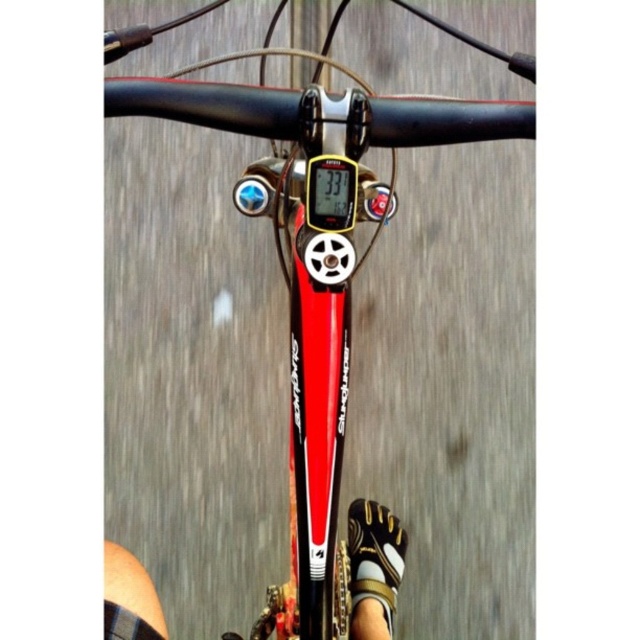
Is shiny metallic bicycle at center taller than white textured shoe at lower center?

Yes, shiny metallic bicycle at center is taller than white textured shoe at lower center.

Does point (168, 97) come closer to viewer compared to point (371, 582)?

Yes, it is.

Identify the location of shiny metallic bicycle at center. This screenshot has height=640, width=640. (316, 264).

Is shiny metallic bicycle at center thinner than white textured sandal at lower center?

In fact, shiny metallic bicycle at center might be wider than white textured sandal at lower center.

Is shiny metallic bicycle at center taller than white textured sandal at lower center?

Indeed, shiny metallic bicycle at center has a greater height compared to white textured sandal at lower center.

Between point (173, 88) and point (355, 572), which one is positioned behind?

Point (355, 572)

This screenshot has width=640, height=640. In order to click on shiny metallic bicycle at center in this screenshot , I will do `click(316, 264)`.

Which is above, white textured shoe at lower center or white textured sandal at lower center?

Positioned higher is white textured shoe at lower center.

Which is in front, point (349, 593) or point (390, 582)?

Point (349, 593) is more forward.

You are a GUI agent. You are given a task and a screenshot of the screen. Output one action in this format:
    pyautogui.click(x=<x>, y=<y>)
    Task: Click on the white textured shoe at lower center
    The width and height of the screenshot is (640, 640).
    Given the screenshot: What is the action you would take?
    pyautogui.click(x=372, y=566)